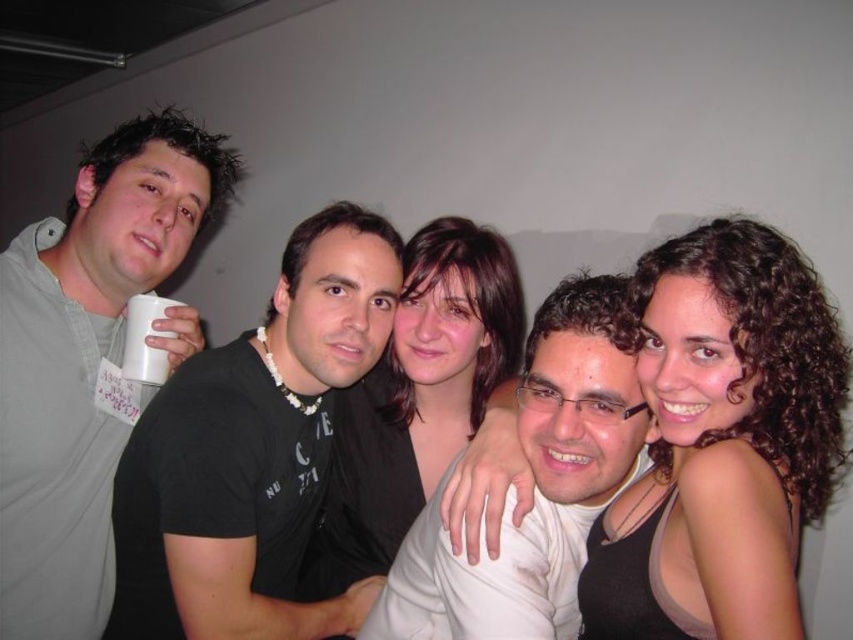
You are standing at the point labeled as point (13, 524) in the image. You want to move to the exit door located at the opposite end of the room. Considering the distance between you and the viewer, can you estimate how many steps it would take to reach the door? Assume each step is about 2.5 feet long.

The distance between you and the viewer is 3.93 feet. Since each step is approximately 2.5 feet long, you would need about 2 steps to cover the distance to the door.